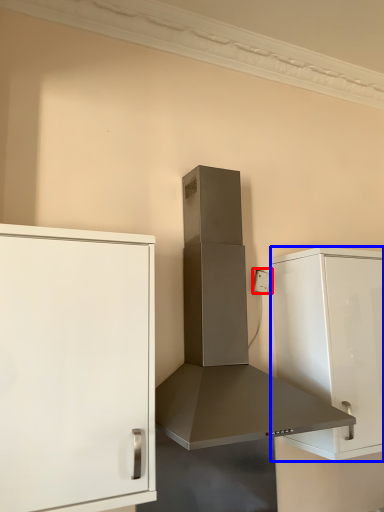
Question: Which object appears closest to the camera in this image, electric outlet (highlighted by a red box) or cabinetry (highlighted by a blue box)?

Choices:
 (A) electric outlet
 (B) cabinetry

Answer: (B)